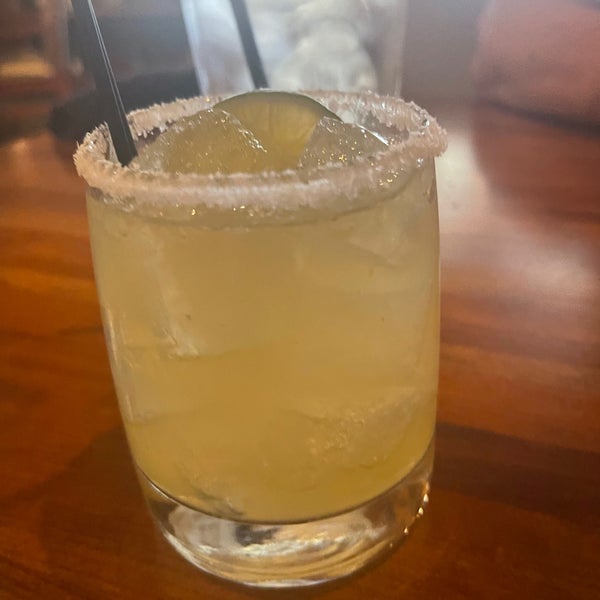
Locate an element on the screen. Image resolution: width=600 pixels, height=600 pixels. cup is located at coordinates (249, 373).